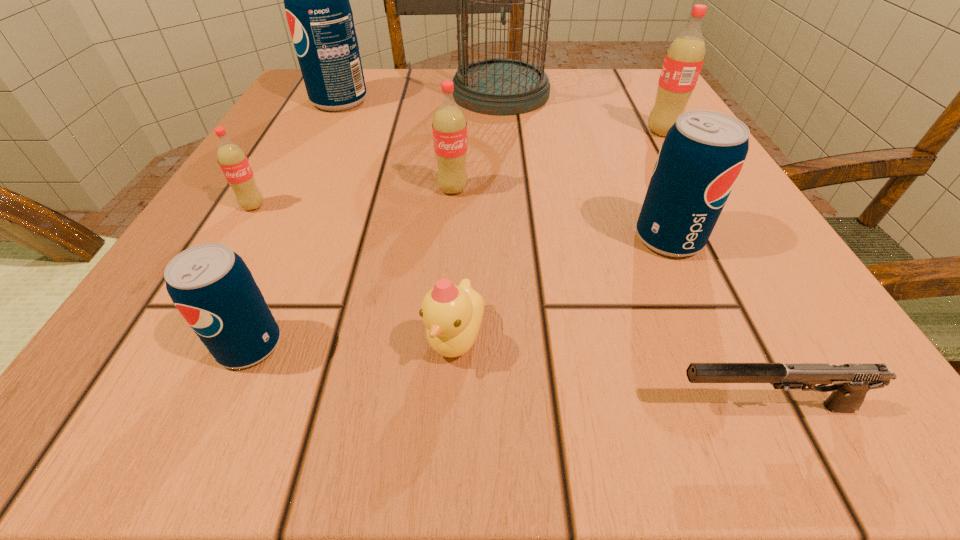
Where is `free space at the left edge of the desktop`? Image resolution: width=960 pixels, height=540 pixels. free space at the left edge of the desktop is located at coordinates (329, 208).

Where is `vacant space at the right edge of the desktop`? The width and height of the screenshot is (960, 540). vacant space at the right edge of the desktop is located at coordinates (628, 161).

Identify the location of vacant space at the far left corner of the desktop. (280, 114).

Find the location of `vacant space at the near left corner`. vacant space at the near left corner is located at coordinates (230, 397).

The height and width of the screenshot is (540, 960). In the image, there is a desktop. What are the coordinates of `vacant space at the far right corner` in the screenshot? It's located at (643, 118).

Identify the location of free space between the gun and the duckling. The image size is (960, 540). (611, 373).

Identify the location of free spot between the farthest blue pop and the second red soda from left to right. This screenshot has height=540, width=960. pos(396,145).

Locate an element on the screen. Image resolution: width=960 pixels, height=540 pixels. blank region between the smallest red soda and the gray gun is located at coordinates (510, 306).

Locate an element on the screen. Image resolution: width=960 pixels, height=540 pixels. unoccupied area between the yellow duckling and the fourth farthest object is located at coordinates (454, 264).

The width and height of the screenshot is (960, 540). What are the coordinates of `vacant area between the smallest blue pop and the gun` in the screenshot? It's located at (508, 376).